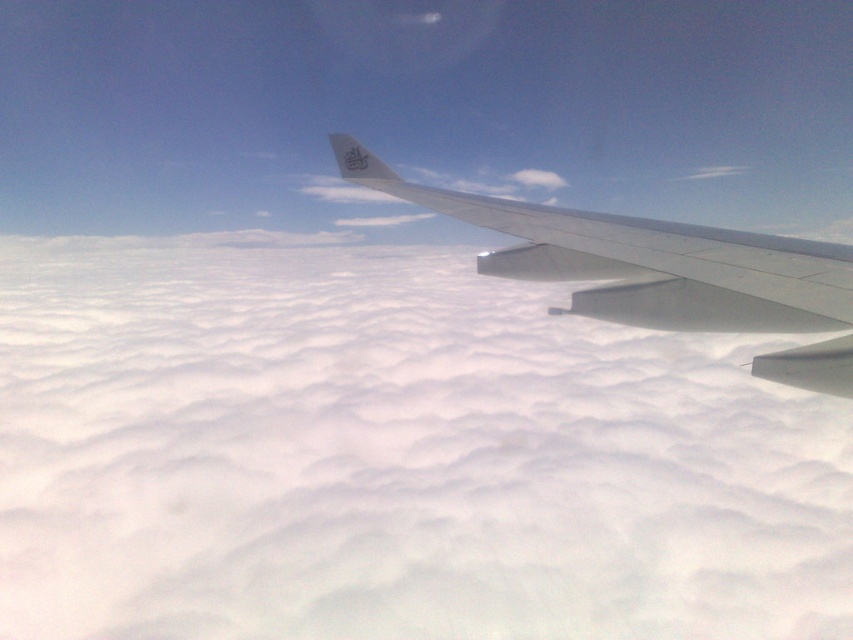
You are a passenger sitting in the airplane and looking out the window. You see a point marked at coordinates (392, 456). Based on the scene, what is the object located at that point?

The point at (392, 456) is on a white fluffy cloud at upper center.

You are a passenger sitting in an airplane seat and looking out the window. You see a metallic gray wing at center and a white fluffy cloud at upper center. Which object is positioned to the left of the other?

The white fluffy cloud at upper center is to the left of the metallic gray wing at center.